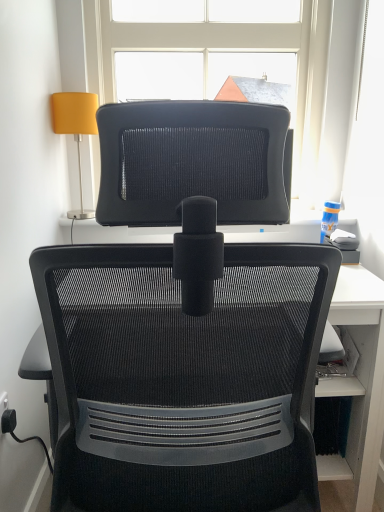
The image size is (384, 512). Find the location of `transparent glass window at upper center`. transparent glass window at upper center is located at coordinates (213, 51).

Describe the element at coordinates (75, 128) in the screenshot. I see `matte yellow fabric lampshade at upper left` at that location.

Image resolution: width=384 pixels, height=512 pixels. I want to click on transparent glass window at upper center, so click(213, 51).

Is transparent glass window at upper center to the left of matte yellow fabric lampshade at upper left from the viewer's perspective?

In fact, transparent glass window at upper center is to the right of matte yellow fabric lampshade at upper left.

The width and height of the screenshot is (384, 512). I want to click on window above the matte yellow fabric lampshade at upper left (from the image's perspective), so click(x=213, y=51).

Is transparent glass window at upper center facing towards matte yellow fabric lampshade at upper left?

Yes, transparent glass window at upper center is oriented towards matte yellow fabric lampshade at upper left.

From a real-world perspective, which object rests below the other?

In real-world perspective, matte yellow fabric lampshade at upper left is lower.

Are black plastic plug at lower left and transparent glass window at upper center beside each other?

black plastic plug at lower left is not next to transparent glass window at upper center, and they're not touching.

Which is closer, (8, 421) or (170, 42)?

Clearly, point (8, 421) is closer to the camera than point (170, 42).

Based on the photo, does black plastic plug at lower left lie behind transparent glass window at upper center?

No, black plastic plug at lower left is closer to the viewer.

From a real-world perspective, does black plastic plug at lower left sit lower than transparent glass window at upper center?

Yes, from a real-world perspective, black plastic plug at lower left is below transparent glass window at upper center.

Between black plastic plug at lower left and matte yellow fabric lampshade at upper left, which one appears on the right side from the viewer's perspective?

matte yellow fabric lampshade at upper left.

Does black plastic plug at lower left contain matte yellow fabric lampshade at upper left?

No, matte yellow fabric lampshade at upper left is not surrounded by black plastic plug at lower left.

Between matte yellow fabric lampshade at upper left and black mesh chair at center, which one is positioned in front?

black mesh chair at center is more forward.

I want to click on chair that is in front of the matte yellow fabric lampshade at upper left, so click(x=187, y=322).

How much distance is there between matte yellow fabric lampshade at upper left and black mesh chair at center?

matte yellow fabric lampshade at upper left and black mesh chair at center are 1.02 meters apart from each other.

Based on the photo, which is nearer, (73,103) or (37,256)?

Point (73,103) is positioned farther from the camera compared to point (37,256).

From the image's perspective, would you say black plastic plug at lower left is positioned over black mesh chair at center?

No, from the image's perspective, black plastic plug at lower left is not above black mesh chair at center.

Is black plastic plug at lower left oriented towards black mesh chair at center?

Yes, black plastic plug at lower left is facing black mesh chair at center.

Does black plastic plug at lower left have a larger size compared to black mesh chair at center?

No.

Does black plastic plug at lower left appear on the right side of black mesh chair at center?

No.

Could you measure the distance between matte yellow fabric lampshade at upper left and black plastic plug at lower left?

matte yellow fabric lampshade at upper left is 92.33 centimeters from black plastic plug at lower left.

Can you confirm if matte yellow fabric lampshade at upper left is bigger than black plastic plug at lower left?

Yes, matte yellow fabric lampshade at upper left is bigger than black plastic plug at lower left.

Between matte yellow fabric lampshade at upper left and black plastic plug at lower left, which one appears on the left side from the viewer's perspective?

Positioned to the left is black plastic plug at lower left.

Which is in front, point (77, 117) or point (261, 3)?

Positioned in front is point (77, 117).

In the scene shown: From the image's perspective, is matte yellow fabric lampshade at upper left located above or below transparent glass window at upper center?

matte yellow fabric lampshade at upper left is below transparent glass window at upper center.

From the picture: From a real-world perspective, relative to transparent glass window at upper center, is matte yellow fabric lampshade at upper left vertically above or below?

matte yellow fabric lampshade at upper left is situated lower than transparent glass window at upper center in the real world.

Measure the distance between matte yellow fabric lampshade at upper left and transparent glass window at upper center.

matte yellow fabric lampshade at upper left is 15.64 inches away from transparent glass window at upper center.

Where is `table lamp below the transparent glass window at upper center (from the image's perspective)`? Image resolution: width=384 pixels, height=512 pixels. table lamp below the transparent glass window at upper center (from the image's perspective) is located at coordinates (75, 128).

Find the location of a particular element. The image size is (384, 512). window behind the black plastic plug at lower left is located at coordinates (213, 51).

When comparing their distances from black mesh chair at center, does black plastic plug at lower left or transparent glass window at upper center seem closer?

black plastic plug at lower left is positioned closer to the anchor black mesh chair at center.

Based on their spatial positions, is black mesh chair at center or matte yellow fabric lampshade at upper left further from transparent glass window at upper center?

Among the two, black mesh chair at center is located further to transparent glass window at upper center.

Estimate the real-world distances between objects in this image. Which object is further from matte yellow fabric lampshade at upper left, transparent glass window at upper center or black mesh chair at center?

Based on the image, black mesh chair at center appears to be further to matte yellow fabric lampshade at upper left.

Looking at the image, which one is located closer to transparent glass window at upper center, matte yellow fabric lampshade at upper left or black plastic plug at lower left?

matte yellow fabric lampshade at upper left lies closer to transparent glass window at upper center than the other object.

In the scene shown: Considering their positions, is transparent glass window at upper center positioned closer to black plastic plug at lower left than black mesh chair at center?

Among the two, black mesh chair at center is located nearer to black plastic plug at lower left.

From the image, which object appears to be nearer to black mesh chair at center, black plastic plug at lower left or matte yellow fabric lampshade at upper left?

black plastic plug at lower left lies closer to black mesh chair at center than the other object.

Based on their spatial positions, is black plastic plug at lower left or matte yellow fabric lampshade at upper left closer to transparent glass window at upper center?

Among the two, matte yellow fabric lampshade at upper left is located nearer to transparent glass window at upper center.

When comparing their distances from matte yellow fabric lampshade at upper left, does black mesh chair at center or transparent glass window at upper center seem closer?

The object closer to matte yellow fabric lampshade at upper left is transparent glass window at upper center.

Locate an element on the screen. plug between black mesh chair at center and matte yellow fabric lampshade at upper left from front to back is located at coordinates (8, 421).

Image resolution: width=384 pixels, height=512 pixels. Identify the location of table lamp positioned between black mesh chair at center and transparent glass window at upper center from near to far. click(x=75, y=128).

Find the location of a particular element. The image size is (384, 512). table lamp between transparent glass window at upper center and black plastic plug at lower left in the up-down direction is located at coordinates (75, 128).

Identify the location of chair between transparent glass window at upper center and black plastic plug at lower left in the up-down direction. (187, 322).